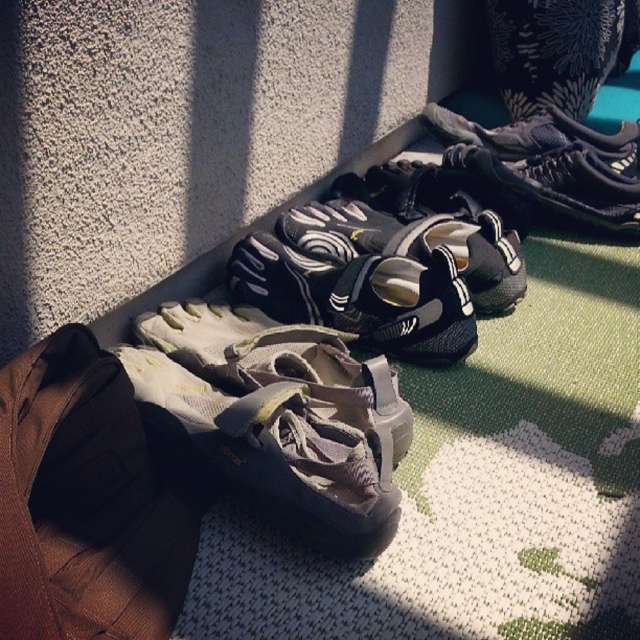
Question: Can you confirm if gray suede sandal at center is bigger than black mesh sneaker at upper right?

Choices:
 (A) no
 (B) yes

Answer: (B)

Question: Which object is positioned closest to the black mesh shoe at center?

Choices:
 (A) gray fabric sandal at center
 (B) gray mesh shoe at center
 (C) black mesh sneaker at upper right
 (D) gray suede sandal at center

Answer: (B)

Question: Which object is the farthest from the black mesh shoe at center?

Choices:
 (A) gray suede sandal at center
 (B) gray mesh shoe at center

Answer: (A)

Question: From the image, what is the correct spatial relationship of gray suede sandal at center in relation to gray mesh shoe at center?

Choices:
 (A) above
 (B) below

Answer: (B)

Question: Does gray mesh shoe at center lie behind black mesh sneaker at upper right?

Choices:
 (A) no
 (B) yes

Answer: (A)

Question: Which point is closer to the camera taking this photo?

Choices:
 (A) (358, 262)
 (B) (236, 314)
 (C) (298, 390)
 (D) (454, 152)

Answer: (C)